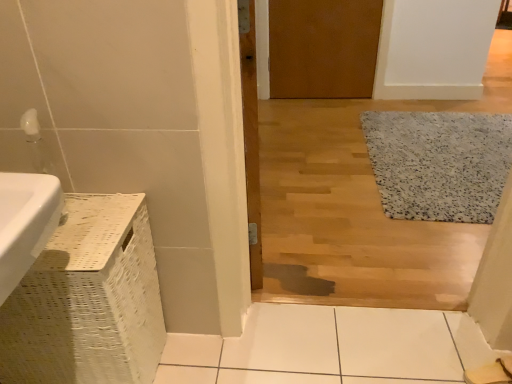
Question: From their relative heights in the image, would you say wooden door at center, which is the 1th door in bottom-to-top order, is taller or shorter than brown matte door at upper center, placed as the 1th door when sorted from top to bottom?

Choices:
 (A) short
 (B) tall

Answer: (B)

Question: Is wooden door at center, positioned as the 2th door in back-to-front order, wider or thinner than brown matte door at upper center, the 1th door positioned from the right?

Choices:
 (A) thin
 (B) wide

Answer: (B)

Question: Which object is the closest to the wooden door at center, which is the 1th door in bottom-to-top order?

Choices:
 (A) brown matte door at upper center, the 1th door positioned from the right
 (B) white speckled rug at right

Answer: (A)

Question: Which of these objects is positioned farthest from the wooden door at center, which is the 2th door in top-to-bottom order?

Choices:
 (A) white speckled rug at right
 (B) brown matte door at upper center, the second door in the bottom-to-top sequence

Answer: (A)